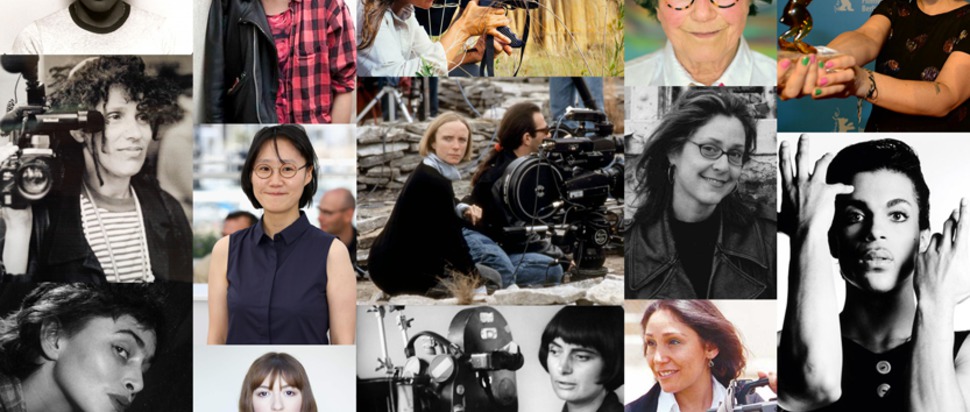
I want to click on black and white photos, so click(x=570, y=350), click(x=728, y=213), click(x=879, y=280), click(x=105, y=364), click(x=94, y=244).